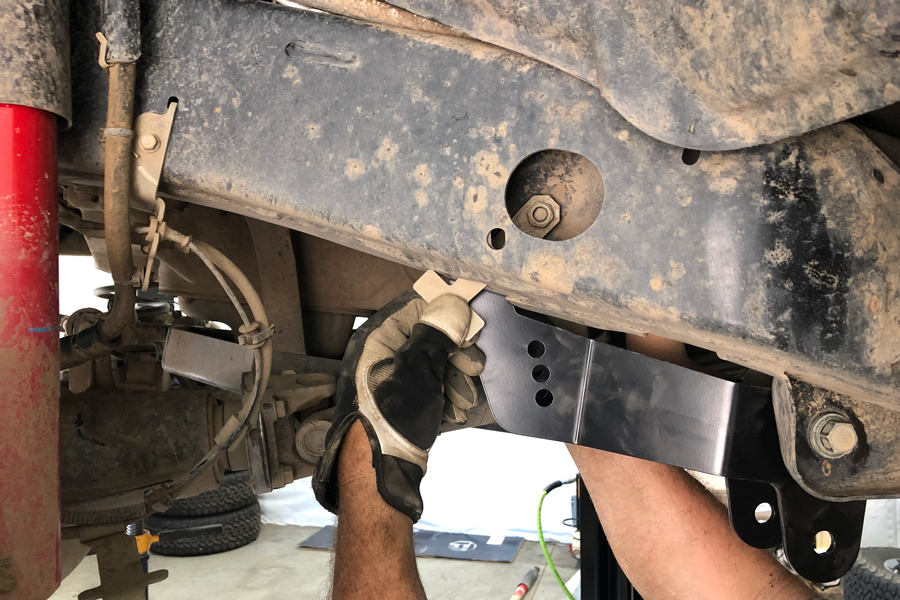
You are a GUI agent. You are given a task and a screenshot of the screen. Output one action in this format:
    pyautogui.click(x=<x>, y=<y>)
    Task: Click on the concrete floor
    
    Given the screenshot: What is the action you would take?
    click(483, 581), click(240, 574)